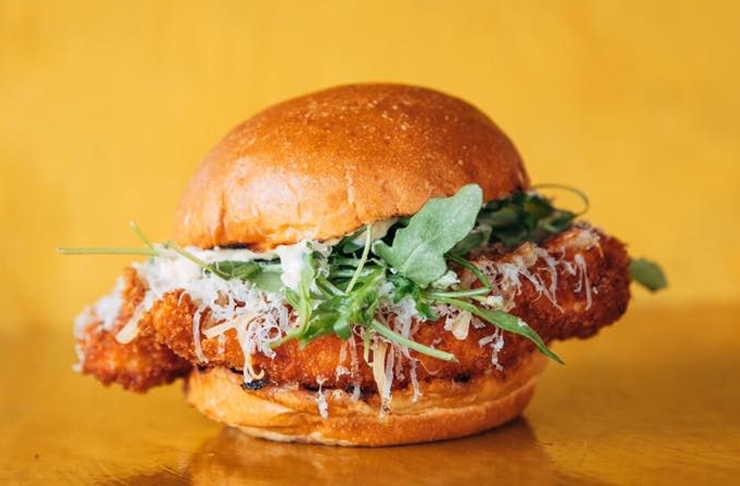
This screenshot has height=486, width=740. What are the coordinates of `table` in the screenshot? It's located at (633, 341).